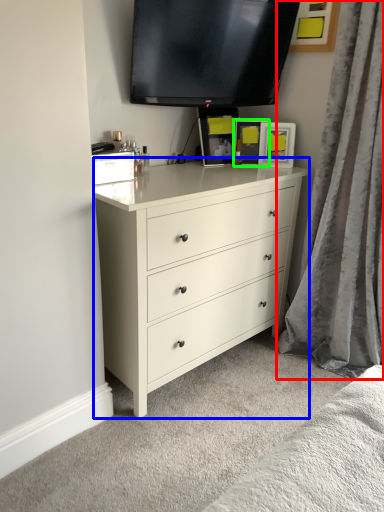
Question: Which is farther away from curtain (highlighted by a red box)? chest of drawers (highlighted by a blue box) or picture frame (highlighted by a green box)?

Choices:
 (A) chest of drawers
 (B) picture frame

Answer: (B)